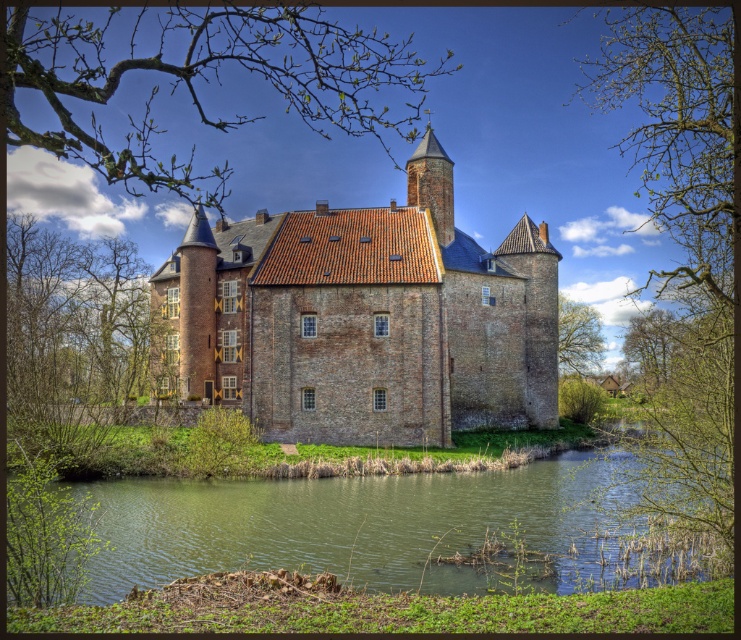
Who is positioned more to the right, green grassy river at lower center or green leafy tree at upper right?

Positioned to the right is green leafy tree at upper right.

Can you confirm if green grassy river at lower center is thinner than green leafy tree at upper right?

Incorrect, green grassy river at lower center's width is not less than green leafy tree at upper right's.

The image size is (741, 640). In order to click on green grassy river at lower center in this screenshot , I will do `click(368, 528)`.

Can you confirm if brown brick castle at center is positioned to the right of bare branches at upper left?

Indeed, brown brick castle at center is positioned on the right side of bare branches at upper left.

Can you confirm if brown brick castle at center is shorter than bare branches at upper left?

Yes.

Locate an element on the screen. Image resolution: width=741 pixels, height=640 pixels. brown brick castle at center is located at coordinates (362, 320).

Is point (33, 355) closer to camera compared to point (597, 369)?

Yes, point (33, 355) is in front of point (597, 369).

Does green leafy tree at left appear under green leafy tree at right?

No.

Does point (24, 275) come behind point (562, 362)?

That is False.

The image size is (741, 640). Find the location of `green leafy tree at left`. green leafy tree at left is located at coordinates (73, 339).